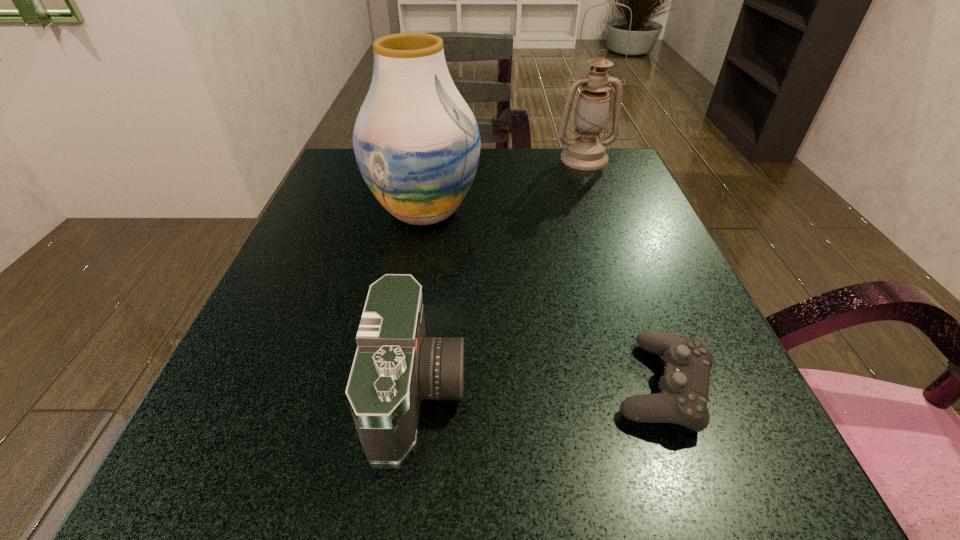
Identify the location of blank space at the near left corner. The width and height of the screenshot is (960, 540). (300, 517).

In the image, there is a desktop. Where is `vacant space at the far right corner`? This screenshot has height=540, width=960. vacant space at the far right corner is located at coordinates (618, 163).

Identify the location of blank region between the oil lamp and the control. (623, 272).

I want to click on vacant area that lies between the oil lamp and the camera, so click(x=501, y=275).

At what (x,y) coordinates should I click in order to perform the action: click on vacant space that is in between the second farthest object and the shortest object. Please return your answer as a coordinate pair (x, y). The height and width of the screenshot is (540, 960). Looking at the image, I should click on (543, 298).

The height and width of the screenshot is (540, 960). Identify the location of vacant area that lies between the farthest object and the control. (623, 272).

Where is `empty space between the vase and the control`? This screenshot has width=960, height=540. empty space between the vase and the control is located at coordinates (543, 298).

At what (x,y) coordinates should I click in order to perform the action: click on vacant space in between the oil lamp and the control. Please return your answer as a coordinate pair (x, y). This screenshot has height=540, width=960. Looking at the image, I should click on (623, 272).

Where is `unoccupied position between the control and the vase`? This screenshot has width=960, height=540. unoccupied position between the control and the vase is located at coordinates (x=543, y=298).

The width and height of the screenshot is (960, 540). Identify the location of empty space that is in between the farthest object and the control. (623, 272).